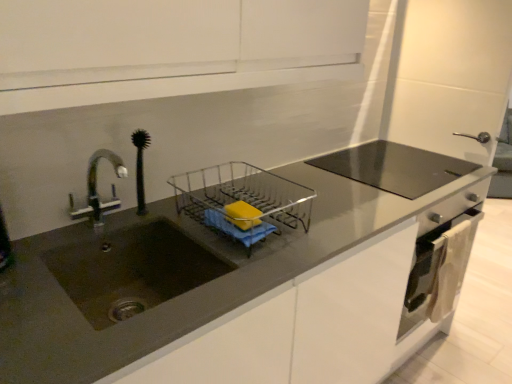
In order to click on free space in front of yellow matte soap at center in this screenshot , I will do tap(246, 268).